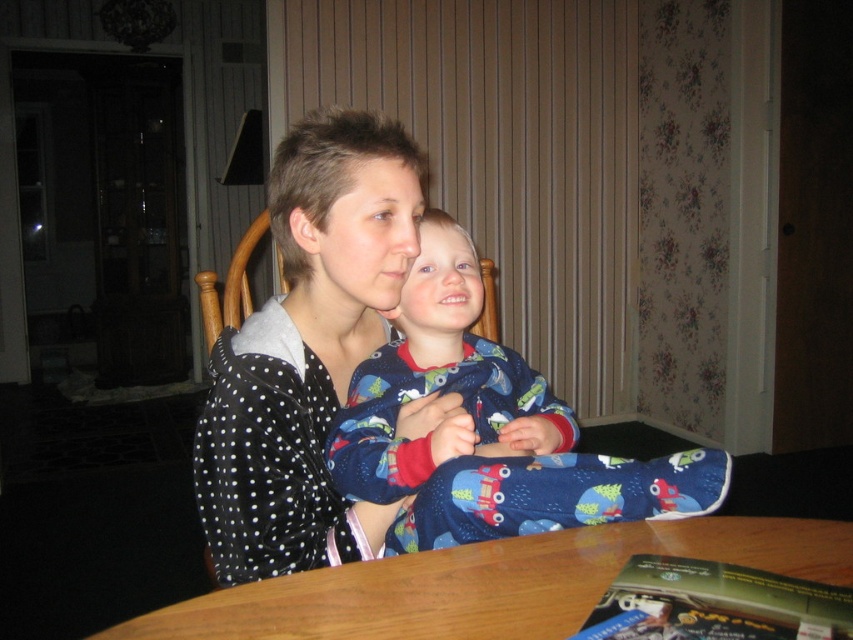
Find the location of a particular element. polka dot fabric at center is located at coordinates (306, 352).

From the picture: Is polka dot fabric at center further to camera compared to blue cotton pajamas at center?

Yes, polka dot fabric at center is behind blue cotton pajamas at center.

I want to click on polka dot fabric at center, so click(x=306, y=352).

Based on the photo, can you confirm if blue cotton pajamas at center is positioned above wooden table at center?

Correct, blue cotton pajamas at center is located above wooden table at center.

Is blue cotton pajamas at center in front of wooden table at center?

No, blue cotton pajamas at center is further to the viewer.

Is point (445, 484) positioned in front of point (519, 572)?

That is False.

In order to click on blue cotton pajamas at center in this screenshot , I will do `click(486, 428)`.

In the scene shown: Is polka dot fabric at center wider than wooden table at center?

No, polka dot fabric at center is not wider than wooden table at center.

Is polka dot fabric at center above wooden table at center?

Correct, polka dot fabric at center is located above wooden table at center.

Locate an element on the screen. Image resolution: width=853 pixels, height=640 pixels. polka dot fabric at center is located at coordinates (306, 352).

Find the location of `polka dot fabric at center`. polka dot fabric at center is located at coordinates (306, 352).